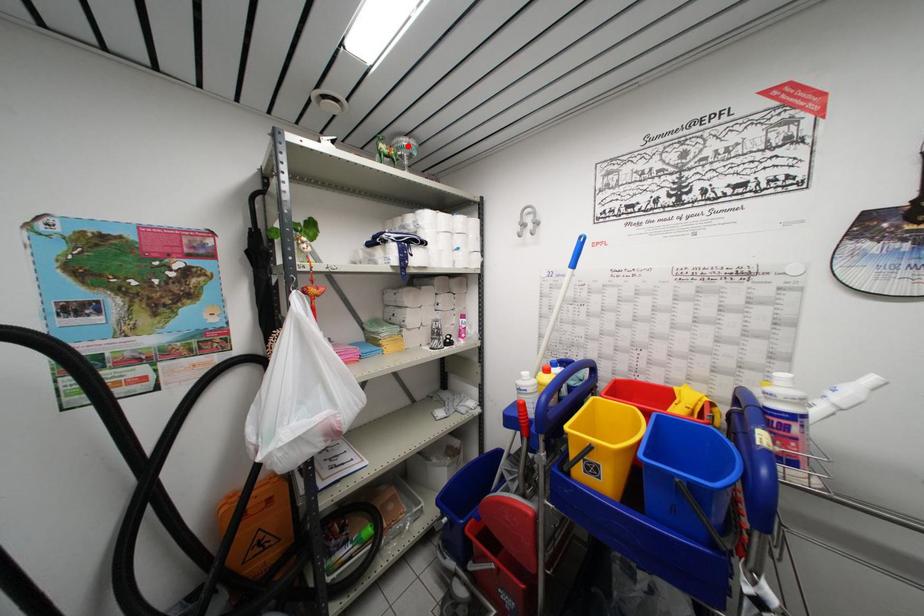
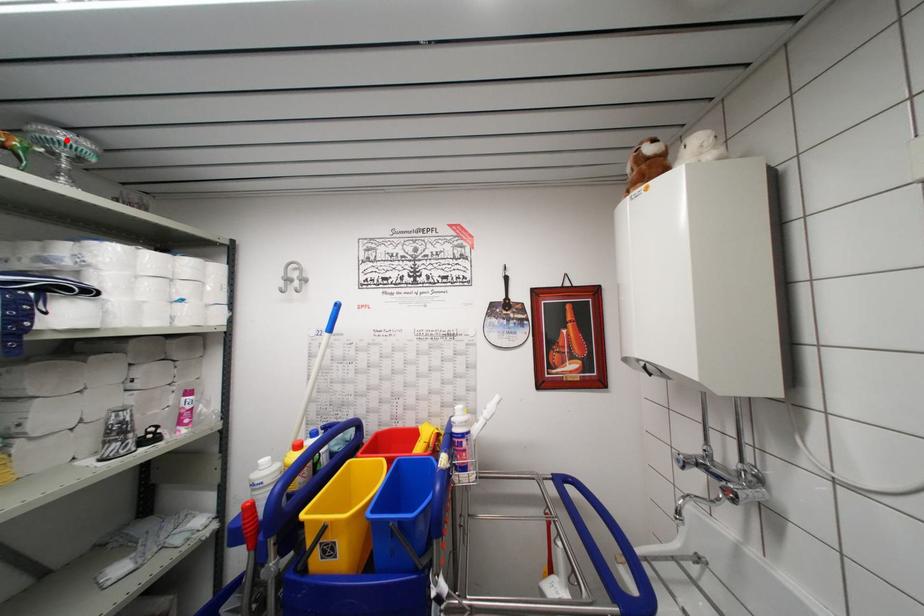
I am providing you with two images of the same scene from different viewpoints. A red point is marked on the first image and another point is marked on the second image. Are the points marked in image1 and image2 representing the same 3D position?

Yes